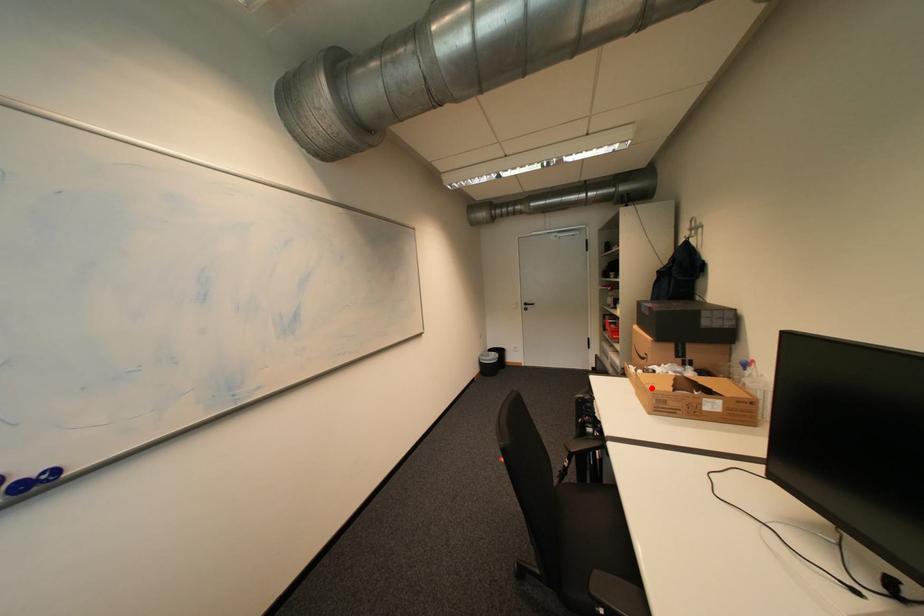
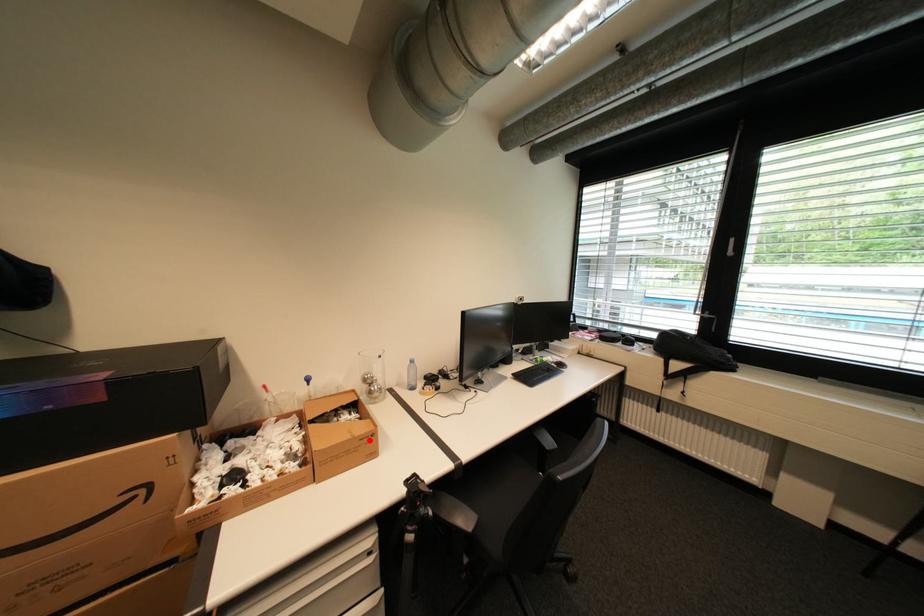
I am providing you with two images of the same scene from different viewpoints. A red point is marked on the first image and another point is marked on the second image. Is the marked point in image1 the same physical position as the marked point in image2?

Yes